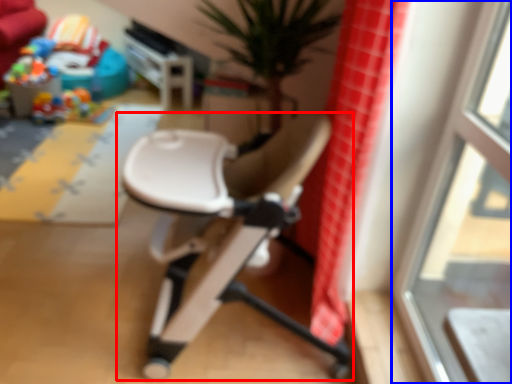
Question: Which of the following is the closest to the observer, chair (highlighted by a red box) or window (highlighted by a blue box)?

Choices:
 (A) chair
 (B) window

Answer: (B)